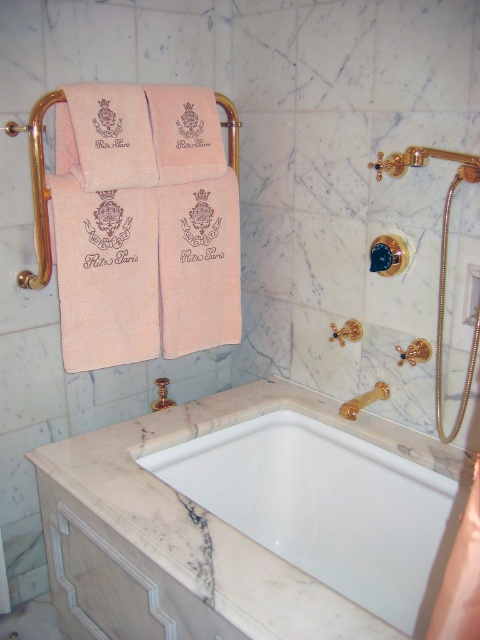
Who is higher up, white marble bathtub at center or pink cotton towel at center?

pink cotton towel at center is higher up.

Is point (384, 600) less distant than point (163, 312)?

Yes, it is in front of point (163, 312).

In order to click on white marble bathtub at center in this screenshot , I will do `click(326, 508)`.

Is pink cotton towel at center to the left of gold metallic shower handle at upper right from the viewer's perspective?

Yes, pink cotton towel at center is to the left of gold metallic shower handle at upper right.

Can you confirm if pink cotton towel at center is shorter than gold metallic shower handle at upper right?

No, pink cotton towel at center is not shorter than gold metallic shower handle at upper right.

I want to click on pink cotton towel at center, so click(x=199, y=264).

Who is shorter, white marble bathtub at center or gold metallic shower handle at upper right?

gold metallic shower handle at upper right

Measure the distance between point (364, 536) and camera.

Point (364, 536) and camera are 1.59 meters apart from each other.

Find the location of `white marble bathtub at center`. white marble bathtub at center is located at coordinates (326, 508).